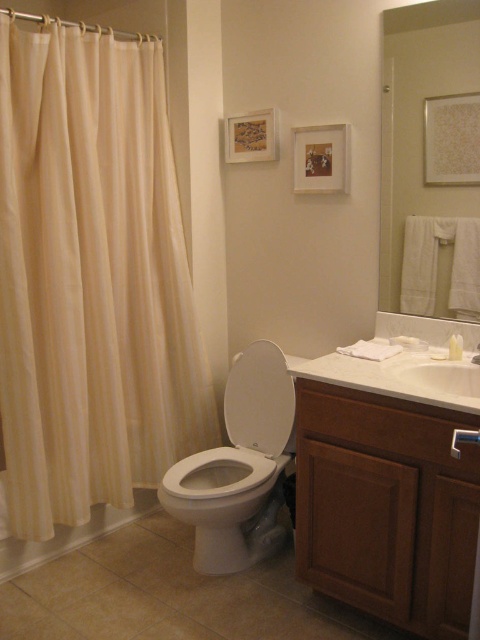
Question: Estimate the real-world distances between objects in this image. Which object is farther from the white glossy toilet bowl at center?

Choices:
 (A) white glossy bathtub at lower left
 (B) beige sheer curtain at left
 (C) white glossy sink at center
 (D) brown wood vanity at lower right

Answer: (C)

Question: Can you confirm if brown wood vanity at lower right is positioned to the right of white glossy toilet bowl at center?

Choices:
 (A) no
 (B) yes

Answer: (B)

Question: Which point is closer to the camera?

Choices:
 (A) (367, 528)
 (B) (231, 396)
 (C) (479, 412)

Answer: (C)

Question: Is brown wood vanity at lower right smaller than white glossy sink at center?

Choices:
 (A) no
 (B) yes

Answer: (A)

Question: Which object is farther from the camera taking this photo?

Choices:
 (A) white glossy toilet bowl at center
 (B) brown wood vanity at lower right
 (C) beige sheer curtain at left

Answer: (A)

Question: Does white glossy toilet bowl at center appear over white glossy bathtub at lower left?

Choices:
 (A) no
 (B) yes

Answer: (B)